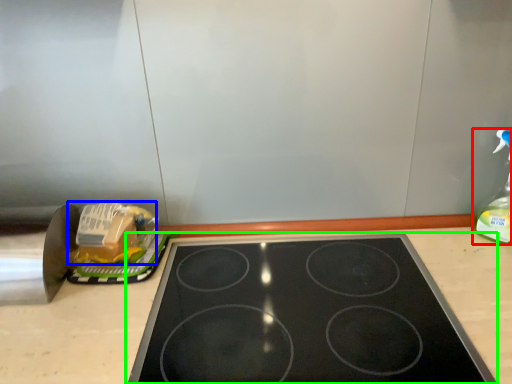
Question: Which object is positioned closest to bottle (highlighted by a red box)? Select from food (highlighted by a blue box) and gas stove (highlighted by a green box).

Choices:
 (A) food
 (B) gas stove

Answer: (B)